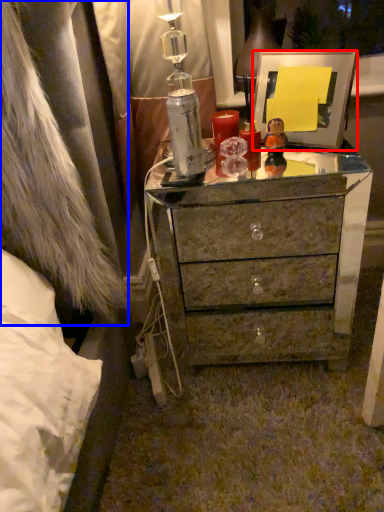
Question: Which object appears farthest to the camera in this image, picture frame (highlighted by a red box) or fur coat (highlighted by a blue box)?

Choices:
 (A) picture frame
 (B) fur coat

Answer: (A)